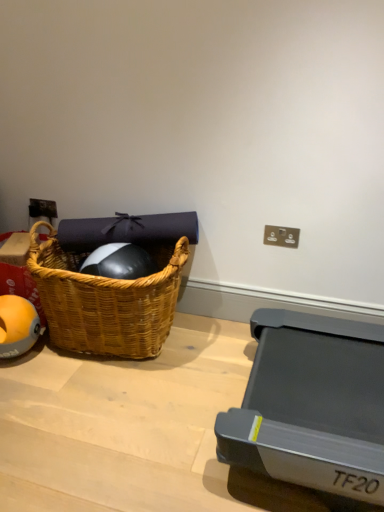
Question: Is the depth of woven wood picnic basket at left less than that of orange rubber ball at left?

Choices:
 (A) no
 (B) yes

Answer: (B)

Question: Does woven wood picnic basket at left have a greater width compared to orange rubber ball at left?

Choices:
 (A) yes
 (B) no

Answer: (A)

Question: From a real-world perspective, is woven wood picnic basket at left under orange rubber ball at left?

Choices:
 (A) yes
 (B) no

Answer: (B)

Question: Is there a large distance between woven wood picnic basket at left and orange rubber ball at left?

Choices:
 (A) no
 (B) yes

Answer: (A)

Question: Is woven wood picnic basket at left positioned behind orange rubber ball at left?

Choices:
 (A) yes
 (B) no

Answer: (B)

Question: Is woven wood picnic basket at left outside of orange rubber ball at left?

Choices:
 (A) no
 (B) yes

Answer: (B)

Question: Considering the relative sizes of woven wood picnic basket at left and matte plastic electric outlet at upper right in the image provided, is woven wood picnic basket at left taller than matte plastic electric outlet at upper right?

Choices:
 (A) yes
 (B) no

Answer: (A)

Question: Does woven wood picnic basket at left touch matte plastic electric outlet at upper right?

Choices:
 (A) no
 (B) yes

Answer: (A)

Question: Is woven wood picnic basket at left not close to matte plastic electric outlet at upper right?

Choices:
 (A) no
 (B) yes

Answer: (A)

Question: Is woven wood picnic basket at left to the left of matte plastic electric outlet at upper right from the viewer's perspective?

Choices:
 (A) yes
 (B) no

Answer: (A)

Question: Is woven wood picnic basket at left thinner than matte plastic electric outlet at upper right?

Choices:
 (A) yes
 (B) no

Answer: (B)

Question: Considering the relative sizes of woven wood picnic basket at left and matte plastic electric outlet at upper right in the image provided, is woven wood picnic basket at left shorter than matte plastic electric outlet at upper right?

Choices:
 (A) no
 (B) yes

Answer: (A)

Question: Could you tell me if matte plastic electric outlet at upper right is facing orange rubber ball at left?

Choices:
 (A) yes
 (B) no

Answer: (B)